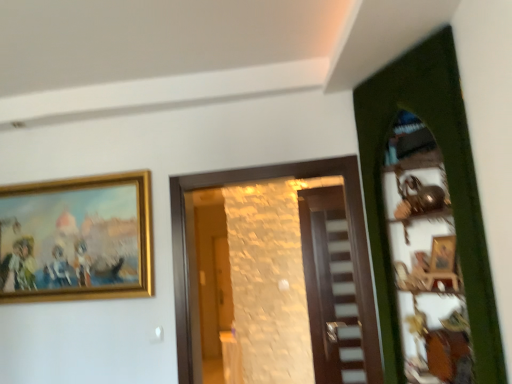
Question: From their relative heights in the image, would you say matte wooden door at center, marked as the third door in a front-to-back arrangement, is taller or shorter than wooden door at center, which ranks as the 2th door in back-to-front order?

Choices:
 (A) short
 (B) tall

Answer: (B)

Question: From the image's perspective, is matte wooden door at center, which is the 1th door from back to front, located above or below wooden door at center, which ranks as the second door in front-to-back order?

Choices:
 (A) below
 (B) above

Answer: (A)

Question: Estimate the real-world distances between objects in this image. Which object is farther from the matte wooden door at center, marked as the third door in a front-to-back arrangement?

Choices:
 (A) wooden door at center, which ranks as the 2th door in back-to-front order
 (B) gold/gilded picture frame at upper left
 (C) green wooden door at right, the 1th door from the front

Answer: (B)

Question: Which is farther from the gold/gilded picture frame at upper left?

Choices:
 (A) matte wooden door at center, which is the 1th door from back to front
 (B) wooden door at center, which ranks as the 2th door in back-to-front order
 (C) green wooden door at right, the 1th door from the front

Answer: (A)